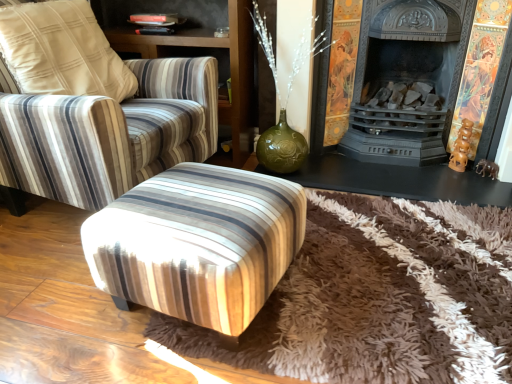
Describe the element at coordinates (198, 243) in the screenshot. I see `wooden stool at center` at that location.

What is the approximate width of brown shaggy rug at center?

brown shaggy rug at center is 2.24 meters in width.

Find the location of a particular element. The width and height of the screenshot is (512, 384). brown shaggy rug at center is located at coordinates (380, 298).

Image resolution: width=512 pixels, height=384 pixels. Describe the element at coordinates (395, 180) in the screenshot. I see `matte black fireplace at center` at that location.

What do you see at coordinates (95, 108) in the screenshot?
I see `striped fabric chair at center` at bounding box center [95, 108].

This screenshot has height=384, width=512. In order to click on wooden stool at center in this screenshot , I will do coord(198,243).

In the scene shown: Between wooden stool at center and black cast iron fireplace at center, which one is positioned in front?

wooden stool at center.

Is wooden stool at center shorter than black cast iron fireplace at center?

Correct, wooden stool at center is not as tall as black cast iron fireplace at center.

Is black cast iron fireplace at center at the back of wooden stool at center?

No.

From a real-world perspective, which is physically above, wooden stool at center or black cast iron fireplace at center?

From a 3D spatial view, black cast iron fireplace at center is above.

What's the angular difference between wooden stool at center and striped fabric armchair at upper left's facing directions?

The angle between the facing direction of wooden stool at center and the facing direction of striped fabric armchair at upper left is 79.9 degrees.

Could you tell me if wooden stool at center is facing striped fabric armchair at upper left?

No, wooden stool at center does not turn towards striped fabric armchair at upper left.

Is the position of wooden stool at center more distant than that of striped fabric armchair at upper left?

No, wooden stool at center is in front of striped fabric armchair at upper left.

This screenshot has width=512, height=384. Identify the location of stool that is in front of the striped fabric armchair at upper left. (198, 243).

Between black cast iron fireplace at center and striped fabric armchair at upper left, which one has larger size?

striped fabric armchair at upper left.

Would you say black cast iron fireplace at center is outside striped fabric armchair at upper left?

black cast iron fireplace at center is positioned outside striped fabric armchair at upper left.

Are black cast iron fireplace at center and striped fabric armchair at upper left beside each other?

No, black cast iron fireplace at center is not touching striped fabric armchair at upper left.

Which is more to the right, brown shaggy rug at center or black cast iron fireplace at center?

Positioned to the right is black cast iron fireplace at center.

From the image's perspective, which one is positioned lower, brown shaggy rug at center or black cast iron fireplace at center?

brown shaggy rug at center, from the image's perspective.

Is brown shaggy rug at center touching black cast iron fireplace at center?

There is a gap between brown shaggy rug at center and black cast iron fireplace at center.

Is black cast iron fireplace at center inside brown shaggy rug at center?

No, black cast iron fireplace at center is not a part of brown shaggy rug at center.

Does matte black fireplace at center have a greater height compared to wooden stool at center?

Incorrect, the height of matte black fireplace at center is not larger of that of wooden stool at center.

From the picture: From a real-world perspective, relative to wooden stool at center, is matte black fireplace at center vertically above or below?

matte black fireplace at center is situated lower than wooden stool at center in the real world.

Is point (505, 187) farther from camera compared to point (151, 264)?

Yes.

Is matte black fireplace at center facing towards wooden stool at center?

No, matte black fireplace at center is not facing towards wooden stool at center.

Identify the location of fireplace behind the brown shaggy rug at center. Image resolution: width=512 pixels, height=384 pixels. (400, 181).

Can you tell me how much black cast iron fireplace at center and brown shaggy rug at center differ in facing direction?

There is a 91-degree angle between the facing directions of black cast iron fireplace at center and brown shaggy rug at center.

In terms of size, does black cast iron fireplace at center appear bigger or smaller than brown shaggy rug at center?

Considering their sizes, black cast iron fireplace at center takes up less space than brown shaggy rug at center.

Would you consider wooden stool at center to be distant from striped fabric chair at center?

wooden stool at center is near striped fabric chair at center, not far away.

Considering the points (181, 281) and (55, 19), which point is behind, point (181, 281) or point (55, 19)?

The point (55, 19) is more distant.

Visually, is wooden stool at center positioned to the left or to the right of striped fabric chair at center?

From the image, it's evident that wooden stool at center is to the right of striped fabric chair at center.

Does wooden stool at center turn towards striped fabric chair at center?

No, wooden stool at center is not turned towards striped fabric chair at center.

You are a GUI agent. You are given a task and a screenshot of the screen. Output one action in this format:
    pyautogui.click(x=<x>, y=<y>)
    Task: Click on the fireplace that appears above the wooden stool at center (from a real-world perspective)
    The width and height of the screenshot is (512, 384).
    Given the screenshot: What is the action you would take?
    pyautogui.click(x=400, y=181)

You are a GUI agent. You are given a task and a screenshot of the screen. Output one action in this format:
    pyautogui.click(x=<x>, y=<y>)
    Task: Click on the stool in front of the striped fabric armchair at upper left
    The image size is (512, 384).
    Given the screenshot: What is the action you would take?
    pyautogui.click(x=198, y=243)

From the picture: Which object lies nearer to the anchor point matte black fireplace at center, striped fabric armchair at upper left or black cast iron fireplace at center?

black cast iron fireplace at center lies closer to matte black fireplace at center than the other object.

Which object lies nearer to the anchor point wooden stool at center, striped fabric armchair at upper left or black cast iron fireplace at center?

Among the two, black cast iron fireplace at center is located nearer to wooden stool at center.

When comparing their distances from brown shaggy rug at center, does matte black fireplace at center or striped fabric armchair at upper left seem further?

striped fabric armchair at upper left is further to brown shaggy rug at center.

Based on the photo, which object lies further to the anchor point matte black fireplace at center, striped fabric armchair at upper left or brown shaggy rug at center?

The object further to matte black fireplace at center is striped fabric armchair at upper left.

Which object lies further to the anchor point matte black fireplace at center, striped fabric chair at center or wooden stool at center?

Among the two, wooden stool at center is located further to matte black fireplace at center.

Based on their spatial positions, is brown shaggy rug at center or wooden stool at center closer to black cast iron fireplace at center?

brown shaggy rug at center.

Looking at this image, looking at the image, which one is located closer to matte black fireplace at center, brown shaggy rug at center or wooden stool at center?

brown shaggy rug at center is closer to matte black fireplace at center.

When comparing their distances from striped fabric chair at center, does matte black fireplace at center or black cast iron fireplace at center seem closer?

matte black fireplace at center is positioned closer to the anchor striped fabric chair at center.

Identify the location of mat situated between wooden stool at center and black cast iron fireplace at center from left to right. The width and height of the screenshot is (512, 384). (380, 298).

Locate an element on the screen. The image size is (512, 384). dresser between striped fabric chair at center and black cast iron fireplace at center in the horizontal direction is located at coordinates (209, 47).

The width and height of the screenshot is (512, 384). In order to click on table between striped fabric chair at center and black cast iron fireplace at center in the horizontal direction in this screenshot , I will do point(395,180).

Locate an element on the screen. The height and width of the screenshot is (384, 512). dresser situated between striped fabric chair at center and matte black fireplace at center from left to right is located at coordinates (209, 47).